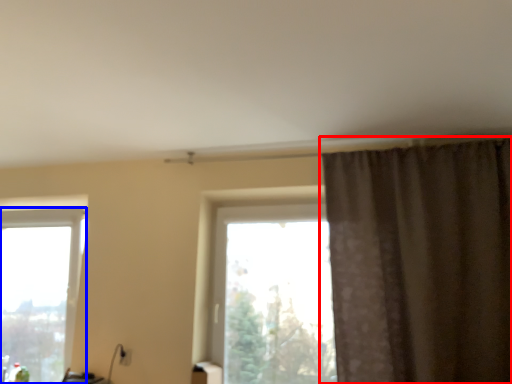
Question: Which of the following is the closest to the observer, curtain (highlighted by a red box) or window (highlighted by a blue box)?

Choices:
 (A) curtain
 (B) window

Answer: (A)